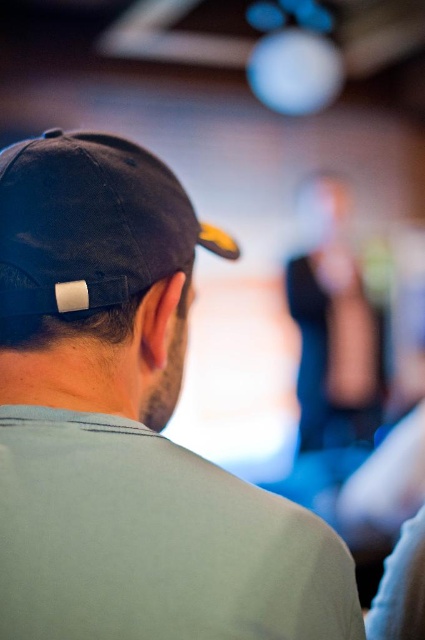
Question: Can you confirm if black matte cap at upper left is bigger than black fabric baseball cap at upper left?

Choices:
 (A) yes
 (B) no

Answer: (A)

Question: Among these points, which one is farthest from the camera?

Choices:
 (A) (68, 288)
 (B) (90, 200)

Answer: (B)

Question: Considering the relative positions of black matte cap at upper left and black fabric baseball cap at upper left in the image provided, where is black matte cap at upper left located with respect to black fabric baseball cap at upper left?

Choices:
 (A) right
 (B) left

Answer: (A)

Question: Which object appears closest to the camera in this image?

Choices:
 (A) black fabric baseball cap at upper left
 (B) black matte cap at upper left

Answer: (B)

Question: Is the position of black matte cap at upper left more distant than that of black fabric baseball cap at upper left?

Choices:
 (A) no
 (B) yes

Answer: (A)